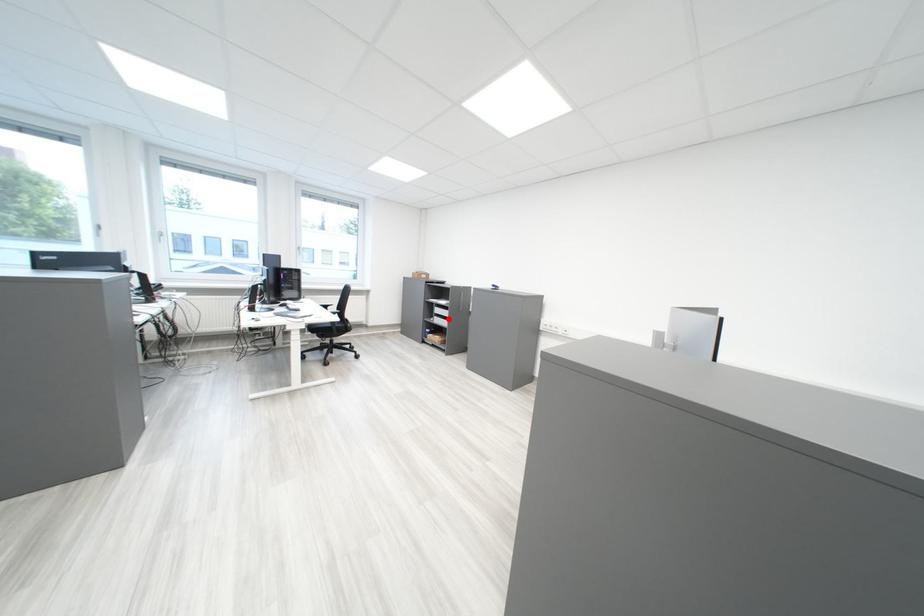
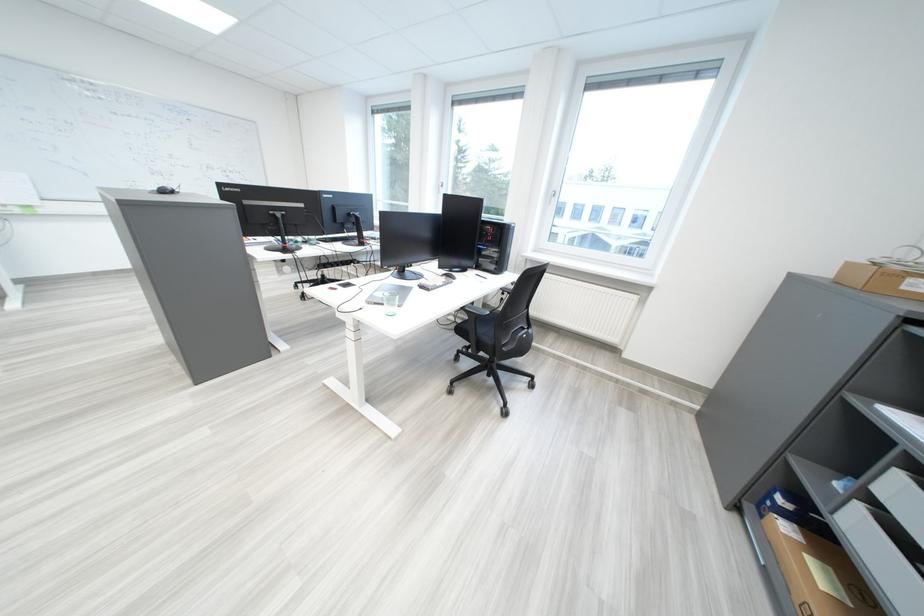
Find the pixel in the second image that matches the highlighted location in the first image.

(873, 509)